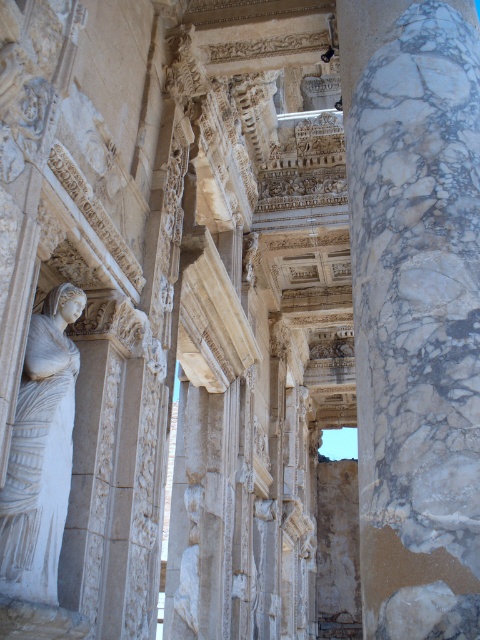
Question: Does marble column at right lie behind white marble statue at left?

Choices:
 (A) no
 (B) yes

Answer: (A)

Question: Can you confirm if marble column at right is positioned to the left of white marble statue at left?

Choices:
 (A) yes
 (B) no

Answer: (B)

Question: Is marble column at right thinner than white marble statue at left?

Choices:
 (A) yes
 (B) no

Answer: (B)

Question: Which object appears closest to the camera in this image?

Choices:
 (A) marble column at right
 (B) white marble statue at left

Answer: (A)